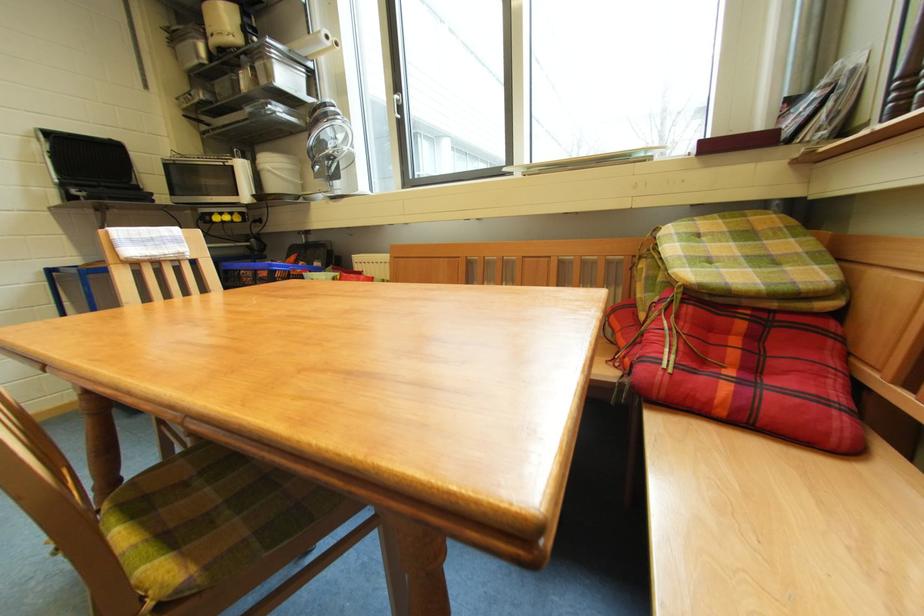
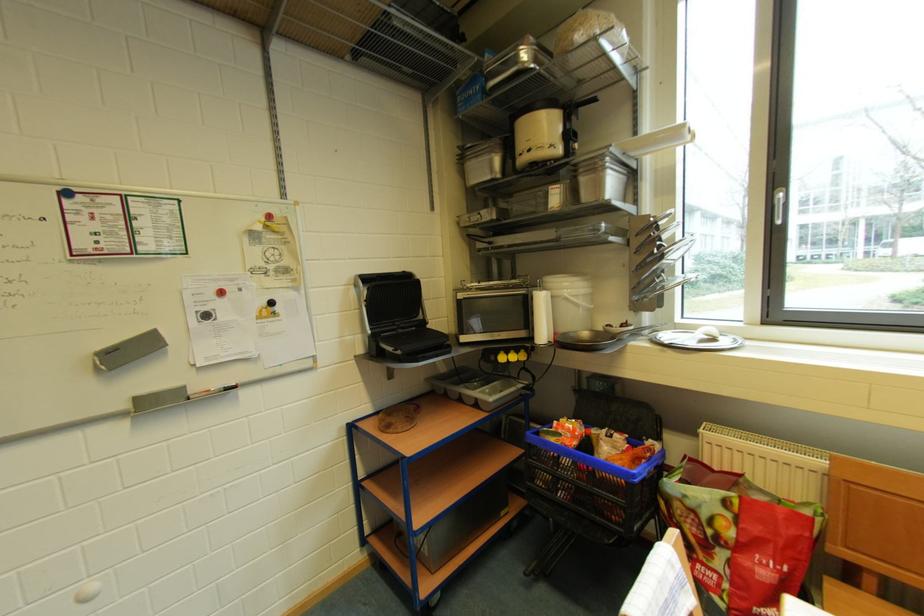
In the second image, find the point that corresponds to [249,169] in the first image.

(548, 302)